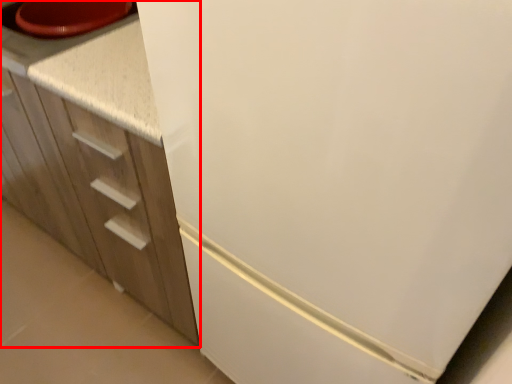
Question: From the image, what is the correct spatial relationship of cabinetry (annotated by the red box) in relation to counter top?

Choices:
 (A) right
 (B) left

Answer: (A)